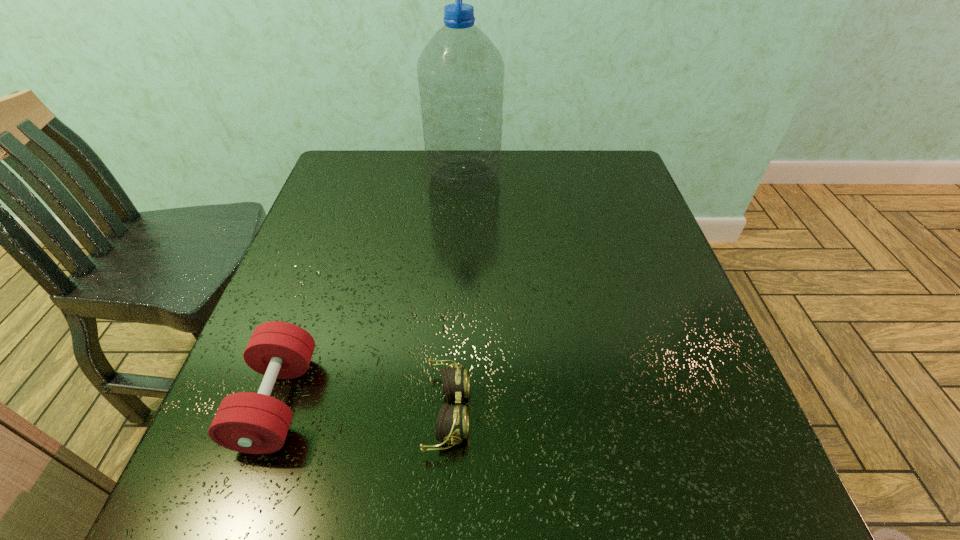
The image size is (960, 540). In the image, there is a desktop. Identify the location of vacant space at the far edge. (387, 190).

In the image, there is a desktop. At what (x,y) coordinates should I click in order to perform the action: click on free region at the near edge. Please return your answer as a coordinate pair (x, y). Image resolution: width=960 pixels, height=540 pixels. Looking at the image, I should click on (303, 499).

I want to click on free space at the left edge of the desktop, so click(318, 231).

The width and height of the screenshot is (960, 540). What are the coordinates of `free location at the near left corner` in the screenshot? It's located at (284, 526).

In order to click on vacant space at the far right corner in this screenshot , I will do `click(630, 185)`.

Locate an element on the screen. This screenshot has width=960, height=540. free space between the goggles and the farthest object is located at coordinates (456, 293).

This screenshot has width=960, height=540. What are the coordinates of `free spot between the tallest object and the second shortest object` in the screenshot? It's located at tap(371, 288).

This screenshot has height=540, width=960. I want to click on blank region between the goggles and the leftmost object, so click(363, 407).

Where is `vacant area that lies between the dumbbell and the goggles`? The height and width of the screenshot is (540, 960). vacant area that lies between the dumbbell and the goggles is located at coordinates (363, 407).

Identify the location of empty location between the goggles and the farthest object. Image resolution: width=960 pixels, height=540 pixels. (456, 293).